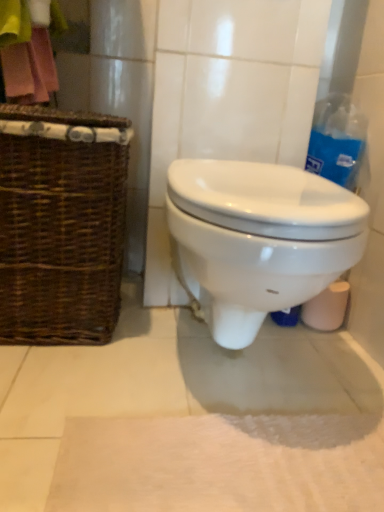
Question: Is white glossy toilet at center bigger or smaller than pink fabric at upper left?

Choices:
 (A) big
 (B) small

Answer: (A)

Question: Is point (284, 212) closer or farther from the camera than point (18, 7)?

Choices:
 (A) farther
 (B) closer

Answer: (B)

Question: Estimate the real-world distances between objects in this image. Which object is farther from the brown woven picnic basket at left?

Choices:
 (A) white soft bath mat at lower center
 (B) white glossy toilet at center
 (C) pink fabric at upper left
 (D) blue plastic bag at upper right

Answer: (D)

Question: Which is farther from the white glossy toilet at center?

Choices:
 (A) pink fabric at upper left
 (B) blue plastic bag at upper right
 (C) white soft bath mat at lower center
 (D) brown woven picnic basket at left

Answer: (A)